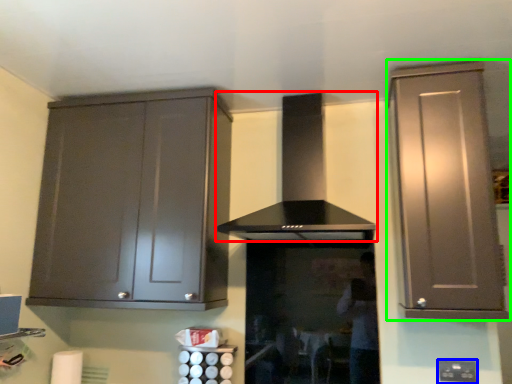
Question: Which object is positioned farthest from home appliance (highlighted by a red box)? Select from electric outlet (highlighted by a blue box) and cabinetry (highlighted by a green box).

Choices:
 (A) electric outlet
 (B) cabinetry

Answer: (A)